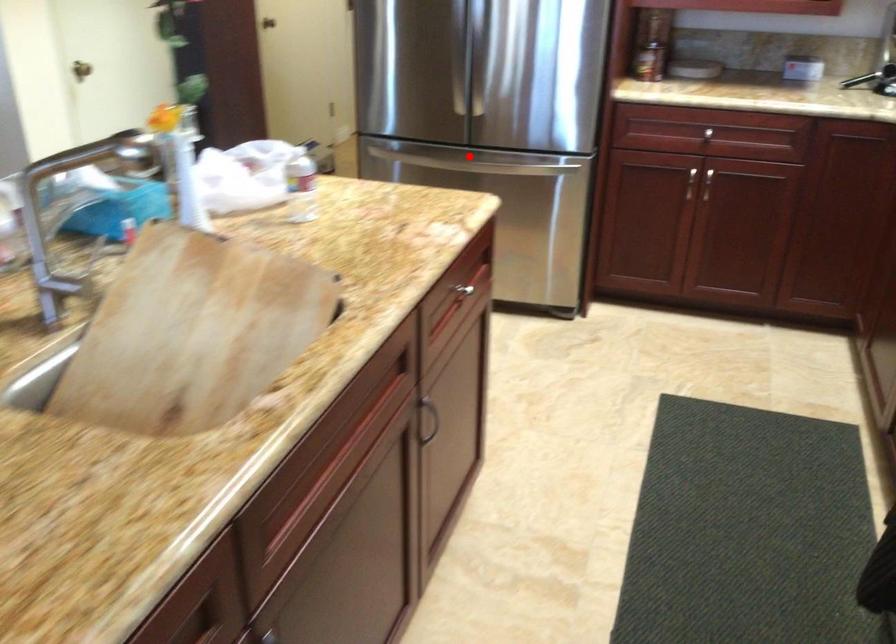
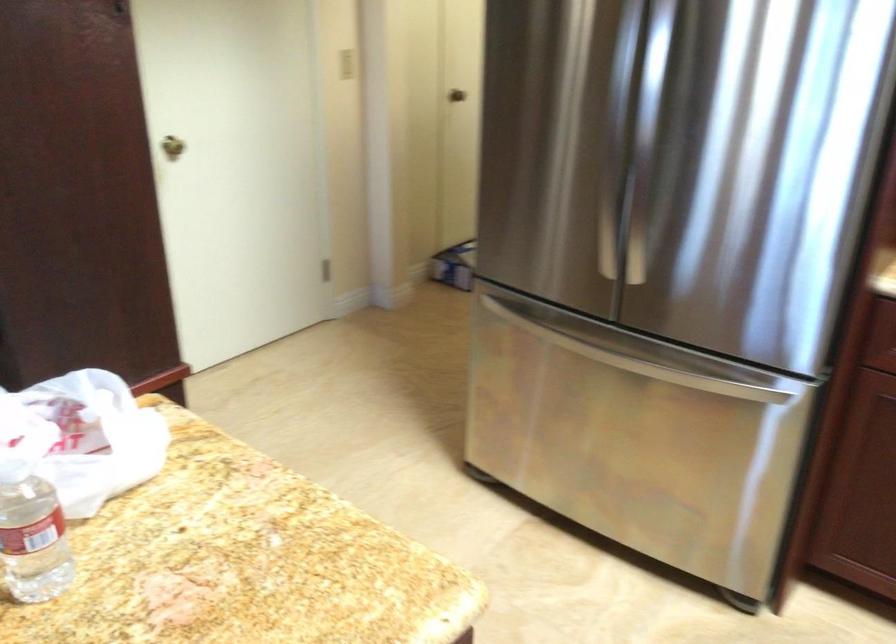
Question: I am providing you with two images of the same scene from different viewpoints. A red point is marked on the first image. Can you still see the location of the red point in image 2?

Choices:
 (A) Yes
 (B) No

Answer: (A)